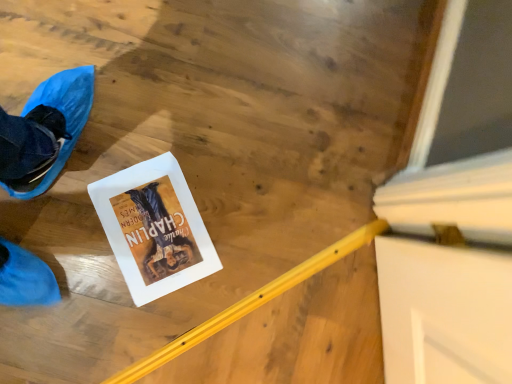
I want to click on free space in front of white paper book cover at center, so click(101, 309).